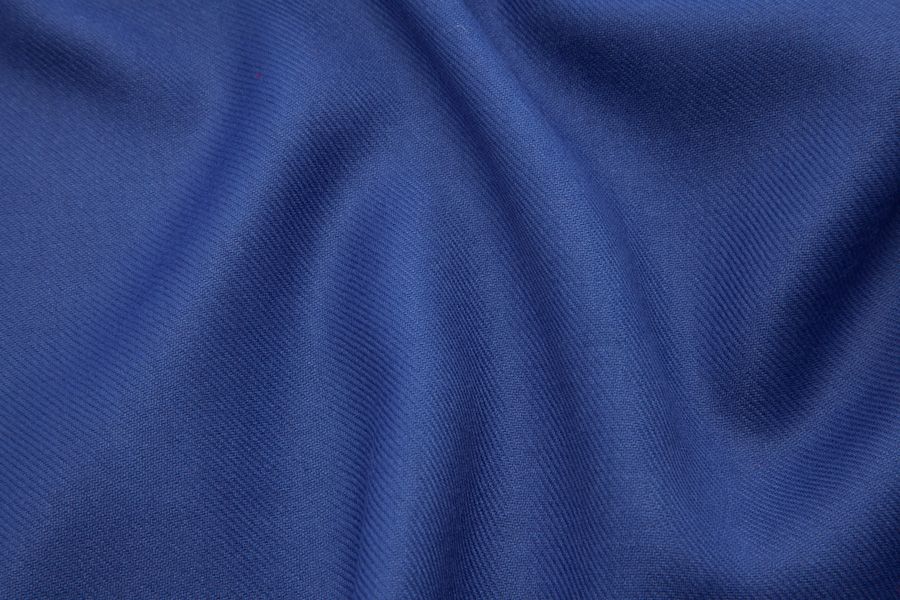
The image size is (900, 600). What are the coordinates of `inside corner on the lower left hand side` in the screenshot? It's located at (15, 585).